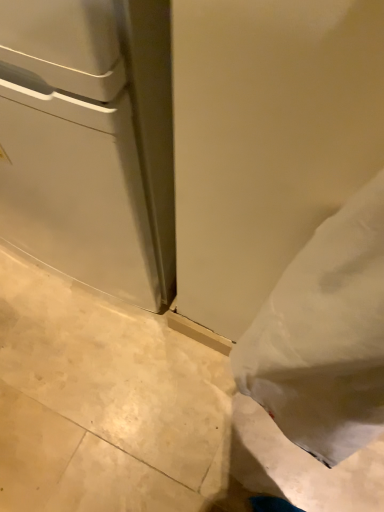
Describe the element at coordinates (90, 142) in the screenshot. I see `stainless steel refrigerator at left` at that location.

In order to click on stainless steel refrigerator at left in this screenshot , I will do `click(90, 142)`.

Identify the location of stainless steel refrigerator at left. The width and height of the screenshot is (384, 512). (90, 142).